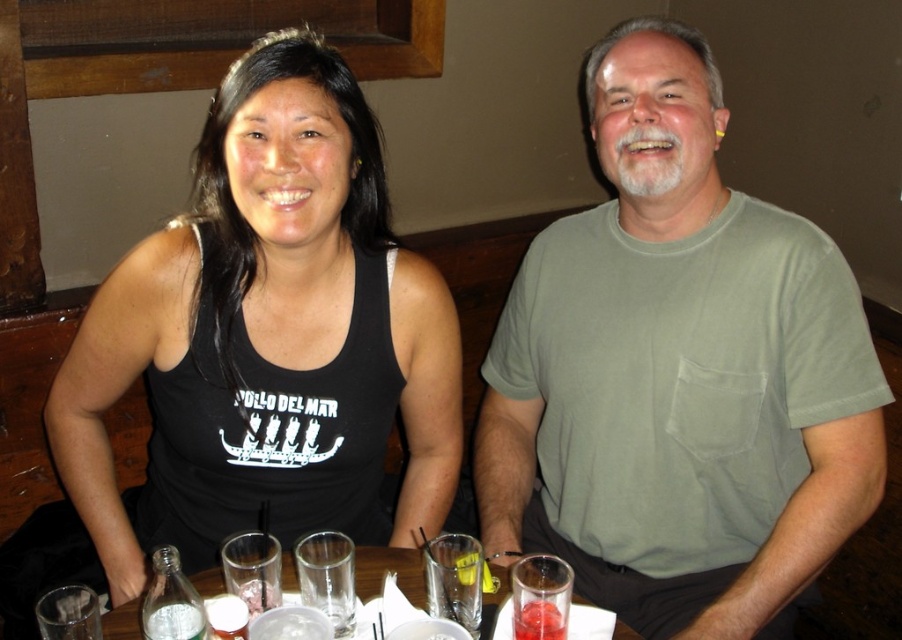
You are a bartender preparing drinks for a party. You have a clear glassware at center and a yellow translucent jelly at center on the table. Which item can hold more liquid?

The clear glassware at center is larger in size than the yellow translucent jelly at center, so it can hold more liquid.

You are a photographer setting up for a portrait. You need to ensure that the black tank top at center and the clear glass bottle at lower left are both visible in the frame. Given their sizes, which object might require you to adjust your camera angle to include it properly?

The black tank top at center is larger in size than the clear glass bottle at lower left, so you might need to adjust your camera angle to ensure the larger black tank top at center fits within the frame properly.